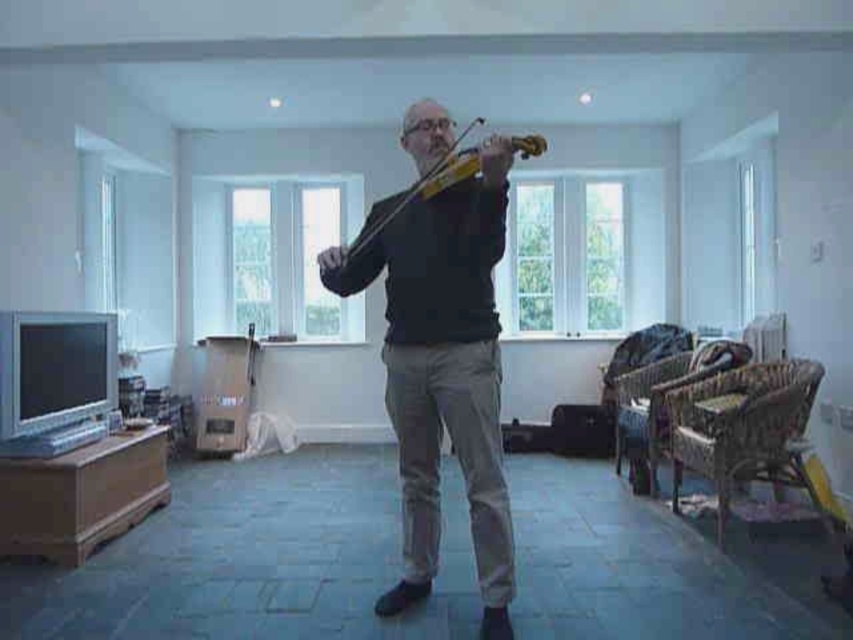
Question: Does dark gray sweater at center have a smaller size compared to wooden violin at center?

Choices:
 (A) yes
 (B) no

Answer: (B)

Question: Among these objects, which one is farthest from the camera?

Choices:
 (A) wooden violin at center
 (B) dark gray sweater at center

Answer: (B)

Question: Is dark gray sweater at center positioned before wooden violin at center?

Choices:
 (A) no
 (B) yes

Answer: (A)

Question: Is dark gray sweater at center positioned in front of wooden violin at center?

Choices:
 (A) no
 (B) yes

Answer: (A)

Question: Which object is closer to the camera taking this photo?

Choices:
 (A) wooden violin at center
 (B) dark gray sweater at center

Answer: (A)